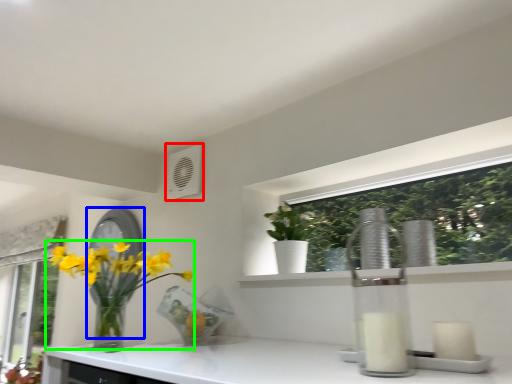
Question: Which object is positioned closest to air conditioning (highlighted by a red box)? Select from mirror (highlighted by a blue box) and houseplant (highlighted by a green box).

Choices:
 (A) mirror
 (B) houseplant

Answer: (A)